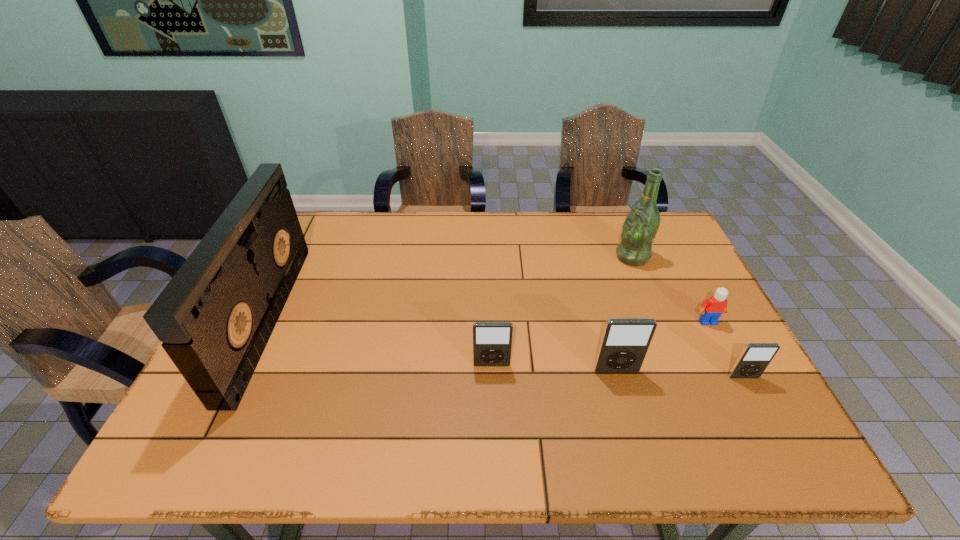
Where is `the closest iPod to the second iPod from left to right`? This screenshot has width=960, height=540. the closest iPod to the second iPod from left to right is located at coordinates (492, 341).

Locate an element on the screen. The image size is (960, 540). iPod that is the closest to the farthest iPod is located at coordinates (625, 341).

You are a GUI agent. You are given a task and a screenshot of the screen. Output one action in this format:
    pyautogui.click(x=<x>, y=<y>)
    Task: Click on the vacant region that satisfies the following two spatial constraints: 1. on the surface of the third object from right to left; 2. on the front-facing side of the second shortest iPod
    Image resolution: width=960 pixels, height=540 pixels.
    Given the screenshot: What is the action you would take?
    pyautogui.click(x=676, y=365)